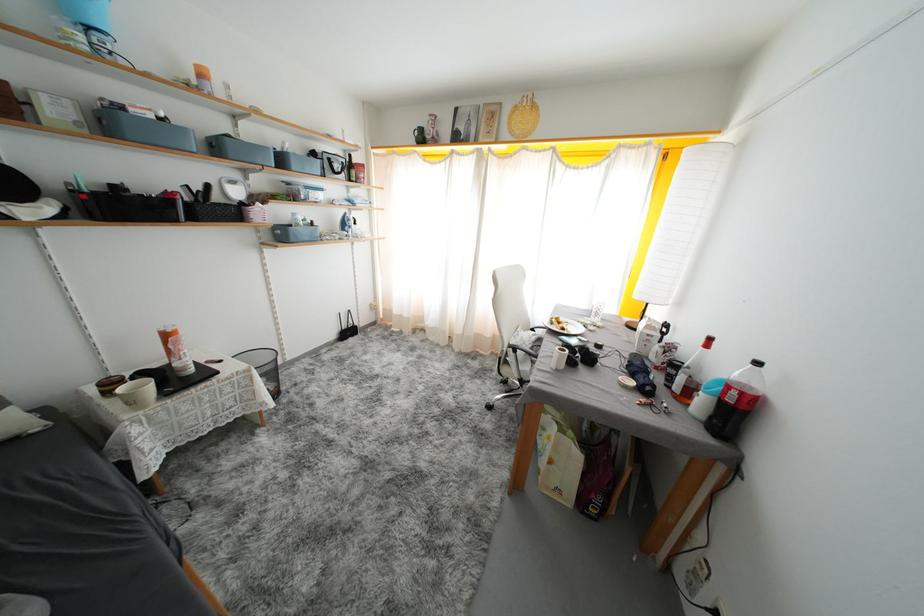
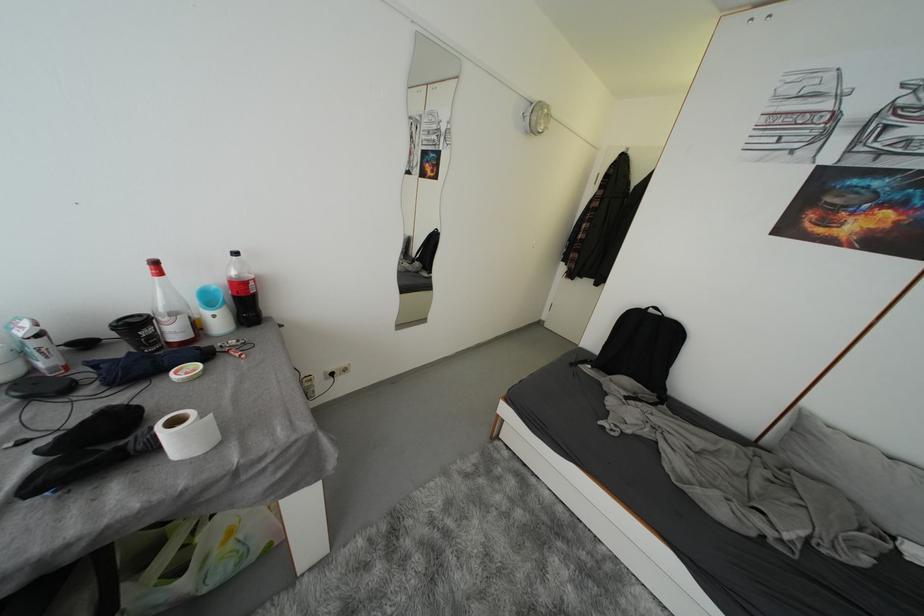
Where in the second image is the point corresponding to point (696, 395) from the first image?

(202, 329)